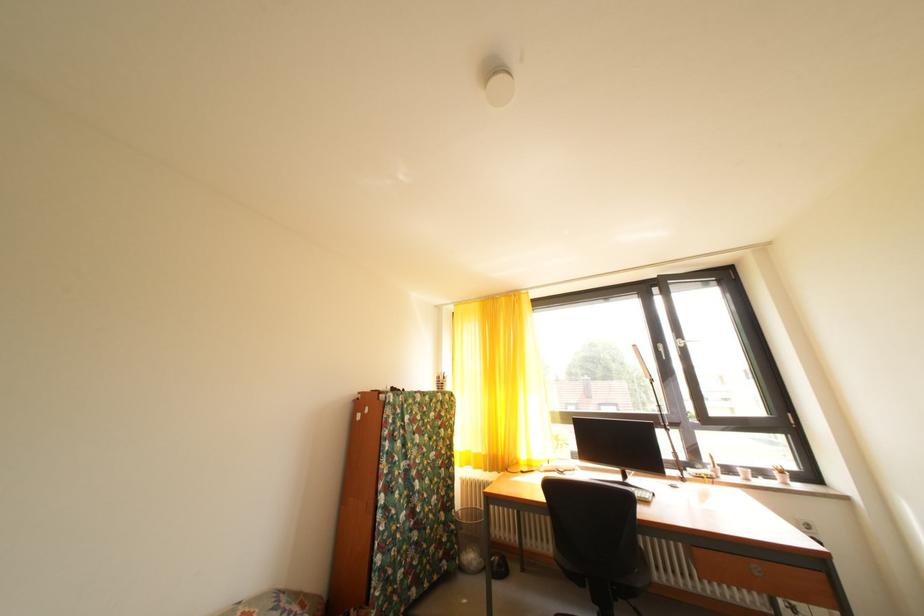
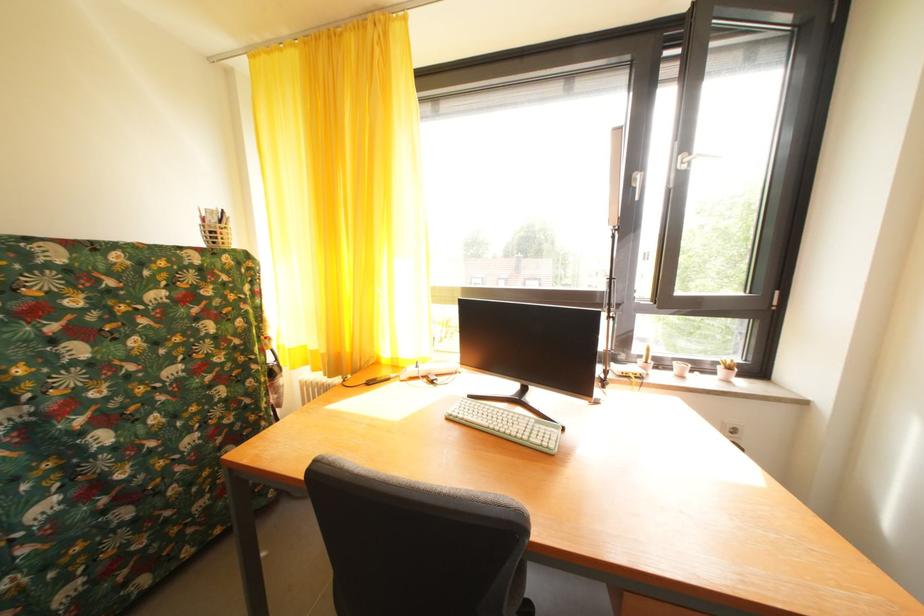
The point at (784, 479) is marked in the first image. Where is the corresponding point in the second image?

(728, 374)